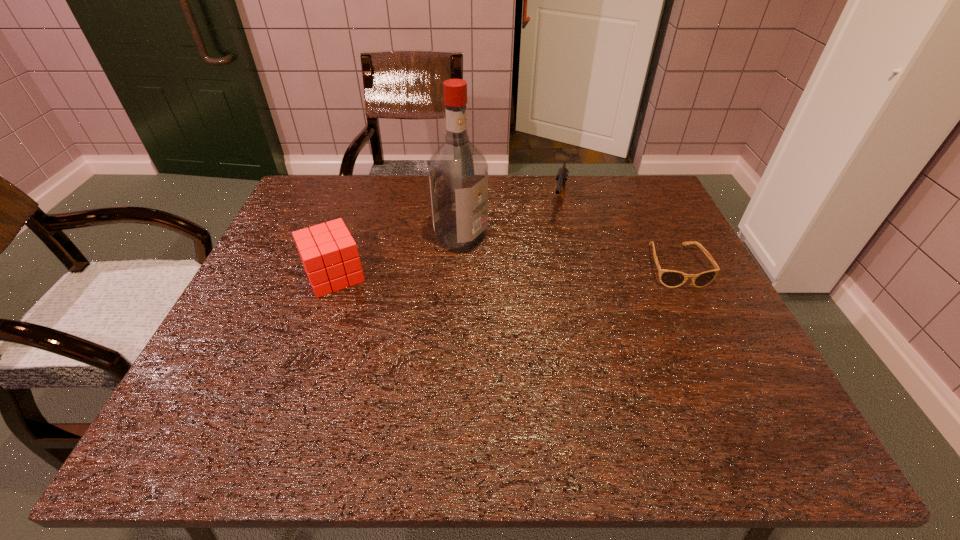
Where is `vacant space located on the front-facing side of the liquor`? Image resolution: width=960 pixels, height=540 pixels. vacant space located on the front-facing side of the liquor is located at coordinates (585, 290).

Locate an element on the screen. The width and height of the screenshot is (960, 540). vacant space located 0.120m along the barrel of the gun is located at coordinates (554, 254).

This screenshot has width=960, height=540. Find the location of `free spot located along the barrel of the gun`. free spot located along the barrel of the gun is located at coordinates (554, 252).

Locate an element on the screen. The height and width of the screenshot is (540, 960). free region located along the barrel of the gun is located at coordinates (550, 269).

Find the location of a particular element. This screenshot has width=960, height=540. object that is at the far edge is located at coordinates (562, 174).

Locate an element on the screen. Image resolution: width=960 pixels, height=540 pixels. object that is at the left edge is located at coordinates (329, 254).

Find the location of `object located at the right edge`. object located at the right edge is located at coordinates (670, 278).

The image size is (960, 540). I want to click on blank space at the far edge, so click(493, 201).

In the image, there is a desktop. Identify the location of free space at the near edge. (389, 389).

This screenshot has width=960, height=540. I want to click on free space at the left edge of the desktop, so click(279, 258).